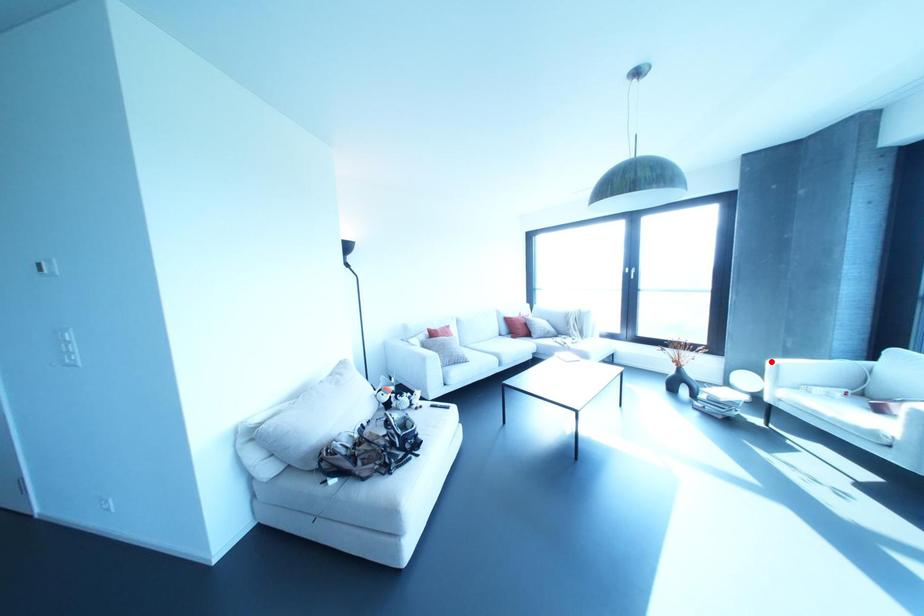
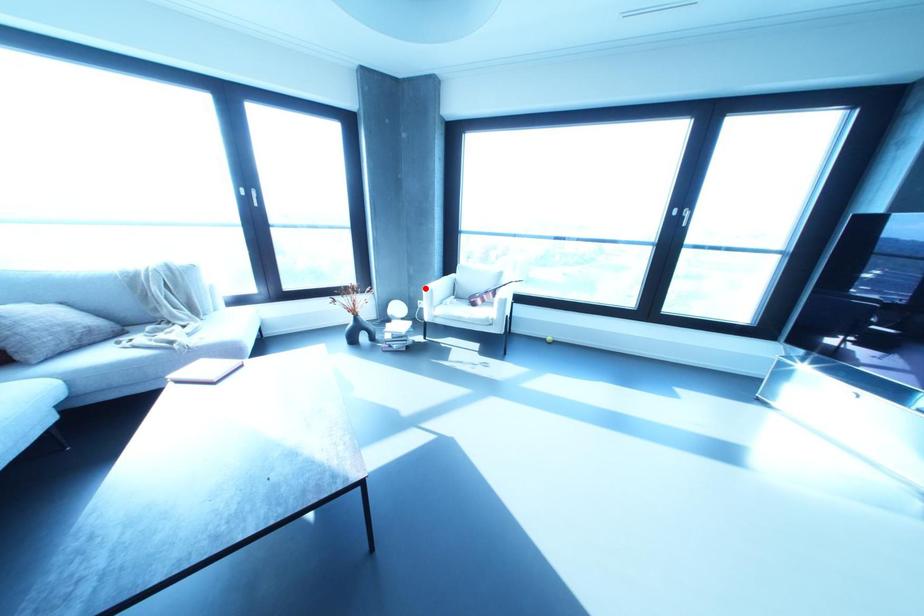
I am providing you with two images of the same scene from different viewpoints. A red point is marked on the first image and another point is marked on the second image. Does the point marked in image1 correspond to the same location as the one in image2?

Yes